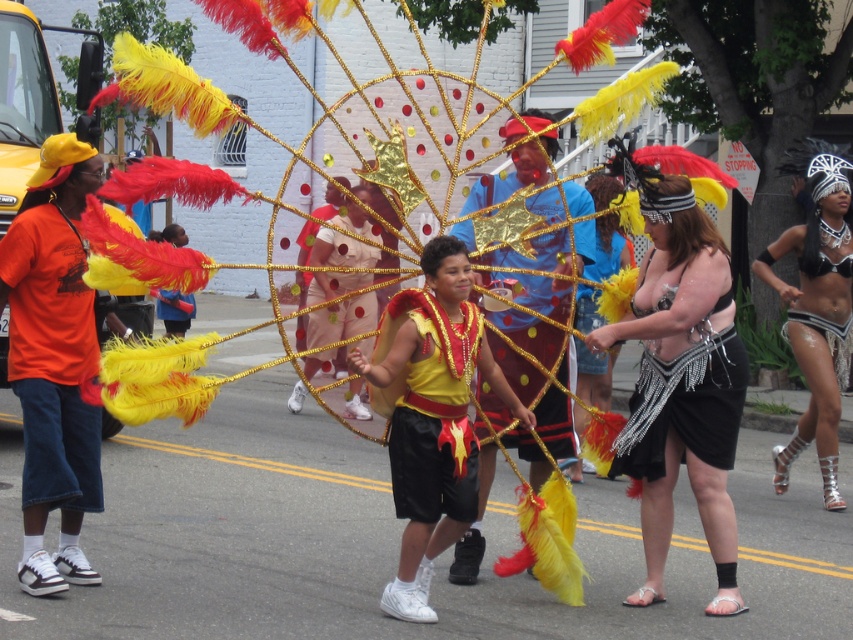
Between shiny black skirt at center and shiny silver sandals at lower right, which one has more height?

shiny silver sandals at lower right is taller.

Which is more to the left, shiny black skirt at center or shiny silver sandals at lower right?

From the viewer's perspective, shiny black skirt at center appears more on the left side.

Which is behind, point (659, 509) or point (804, 157)?

Point (804, 157)

What are the coordinates of `shiny black skirt at center` in the screenshot? It's located at (682, 384).

Is point (527, 200) positioned before point (827, 224)?

Yes.

Does matte blue shirt at center have a greater height compared to black sequined bikini at center?

Yes.

Locate an element on the screen. matte blue shirt at center is located at coordinates (532, 337).

Does shiny black skirt at center appear on the left side of black sequined bikini at center?

Correct, you'll find shiny black skirt at center to the left of black sequined bikini at center.

Based on the photo, is shiny black skirt at center taller than black sequined bikini at center?

Correct, shiny black skirt at center is much taller as black sequined bikini at center.

Consider the image. Who is more distant from viewer, (651, 387) or (805, 268)?

The point (805, 268) is more distant.

Find the location of a particular element. The width and height of the screenshot is (853, 640). shiny black skirt at center is located at coordinates (682, 384).